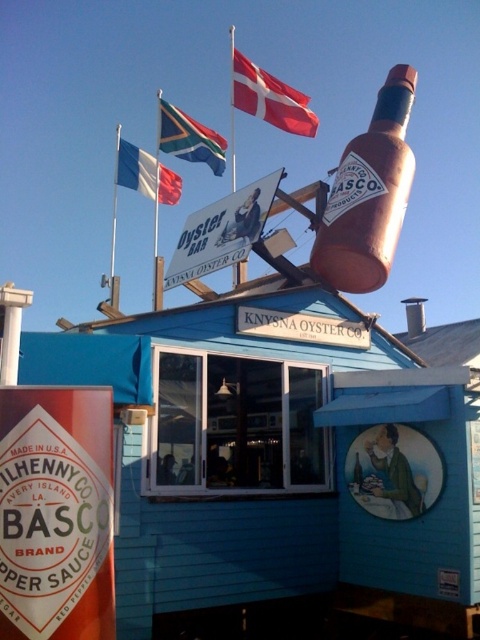
Question: Which is nearer to the south african flag at upper center?

Choices:
 (A) white fabric flag at upper left
 (B) blue wooden hut at center
 (C) red fabric flag at upper center

Answer: (C)

Question: From the image, what is the correct spatial relationship of blue wooden hut at center in relation to white fabric flag at upper left?

Choices:
 (A) above
 (B) below

Answer: (B)

Question: Can you confirm if brown matte bottle at upper center is positioned above red fabric flag at upper center?

Choices:
 (A) yes
 (B) no

Answer: (B)

Question: Which object is positioned closest to the white fabric flag at upper left?

Choices:
 (A) blue wooden hut at center
 (B) brown matte bottle at upper center
 (C) south african flag at upper center

Answer: (C)

Question: Estimate the real-world distances between objects in this image. Which object is closer to the south african flag at upper center?

Choices:
 (A) blue wooden hut at center
 (B) brown matte bottle at upper center
 (C) red fabric flag at upper center
 (D) white fabric flag at upper left

Answer: (C)

Question: Can you confirm if blue wooden hut at center is positioned to the left of red fabric flag at upper center?

Choices:
 (A) yes
 (B) no

Answer: (B)